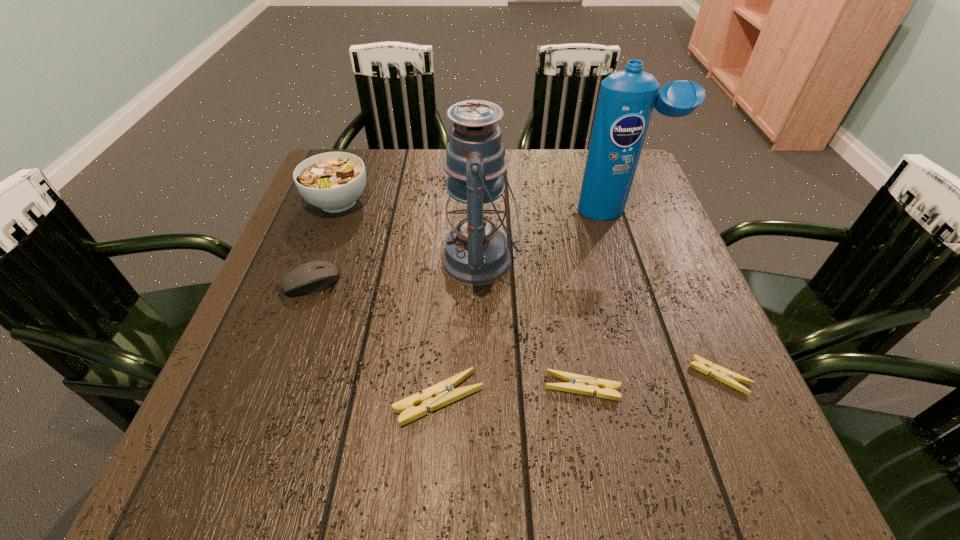
All clothespins are currently evenly spaced. To continue this pattern, where would you add another clothespin on the left? Please point out a vacant spot. Please provide its 2D coordinates. Your answer should be formatted as a tuple, i.e. [(x, y)], where the tuple contains the x and y coordinates of a point satisfying the conditions above.

[(290, 411)]